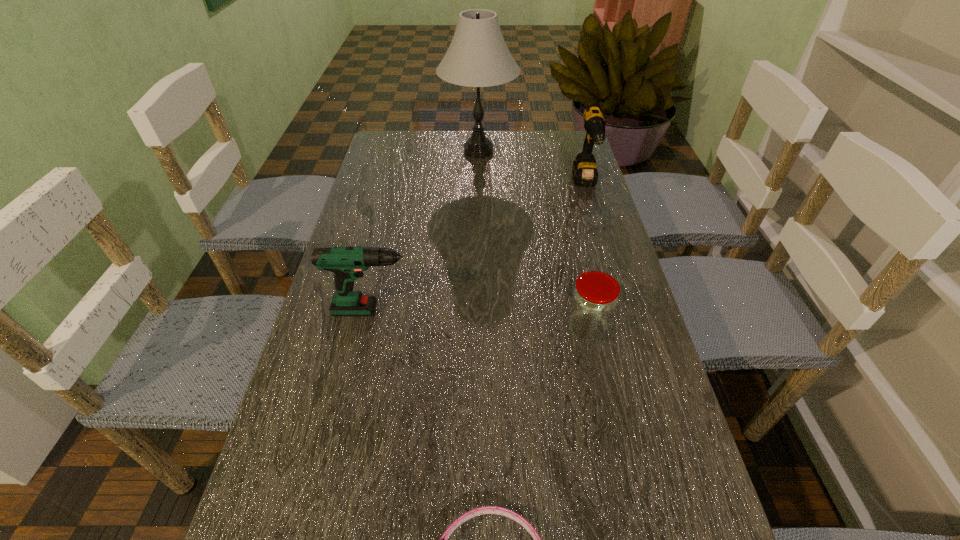
The image size is (960, 540). Identify the location of lamp. (478, 56).

The image size is (960, 540). Find the location of `the right drill`. the right drill is located at coordinates (584, 170).

Identify the location of the farther drill. The image size is (960, 540). (584, 170).

Where is `the nearer drill`? The width and height of the screenshot is (960, 540). the nearer drill is located at coordinates tap(347, 263).

This screenshot has height=540, width=960. Find the location of `the second object from right to left`. the second object from right to left is located at coordinates (594, 299).

The image size is (960, 540). In order to click on jar in this screenshot , I will do `click(594, 299)`.

I want to click on free space located on the front of the tallest object, so click(478, 183).

Where is `free space located at the tip of the right drill`? free space located at the tip of the right drill is located at coordinates [x=612, y=271].

I want to click on vacant region located on the handle side of the left drill, so click(483, 310).

The width and height of the screenshot is (960, 540). I want to click on vacant area situated on the left of the fourth object from left to right, so click(413, 328).